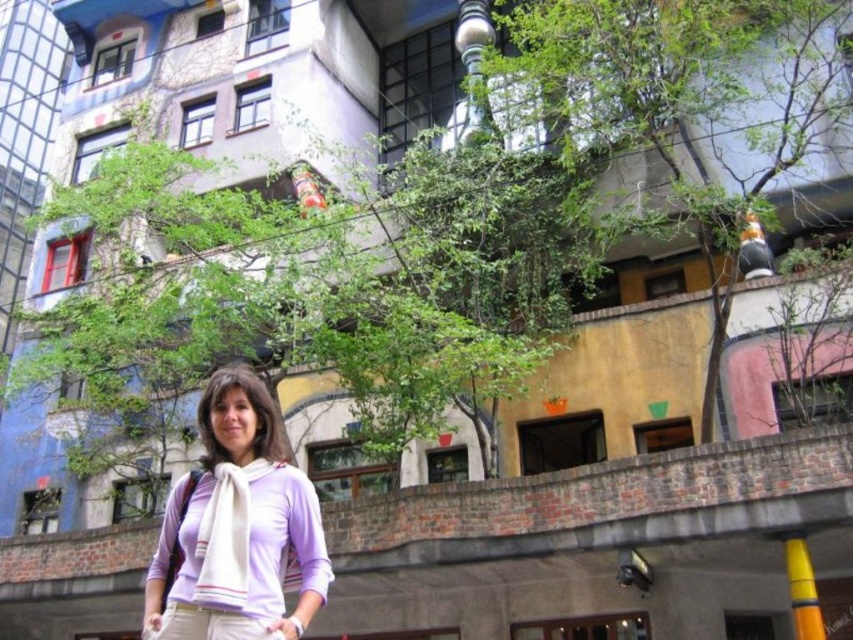
Question: Can you confirm if green leafy tree at center is smaller than green leafy tree at upper center?

Choices:
 (A) no
 (B) yes

Answer: (A)

Question: Among these objects, which one is nearest to the camera?

Choices:
 (A) green leafy tree at center
 (B) green leafy tree at upper center

Answer: (A)

Question: Is green leafy tree at center further to camera compared to green leafy tree at upper center?

Choices:
 (A) yes
 (B) no

Answer: (B)

Question: Which point is closer to the camera?

Choices:
 (A) green leafy tree at center
 (B) green leafy tree at upper center

Answer: (A)

Question: Does green leafy tree at center have a larger size compared to green leafy tree at upper center?

Choices:
 (A) yes
 (B) no

Answer: (A)

Question: Which point is closer to the camera taking this photo?

Choices:
 (A) (299, 250)
 (B) (724, 320)
 (C) (260, 605)

Answer: (C)